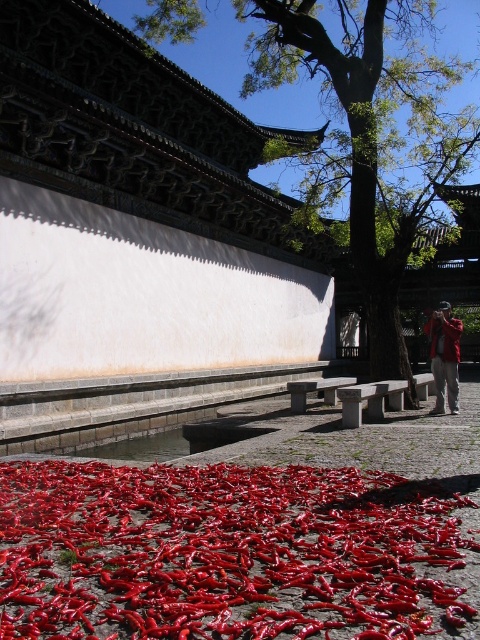
You are standing in the scene and want to pick up the red matte pepper at lower center and the red fabric jacket at lower right. Which object is closer to the ground?

The red matte pepper at lower center is shorter than the red fabric jacket at lower right, so the red matte pepper at lower center is closer to the ground.

You are standing in front of the white wall with black decorative patterns and looking at the two points marked in the scene. Which point, point (x=176, y=563) or point (x=388, y=77), is closer to you?

Point (x=176, y=563) is closer to you than point (x=388, y=77).